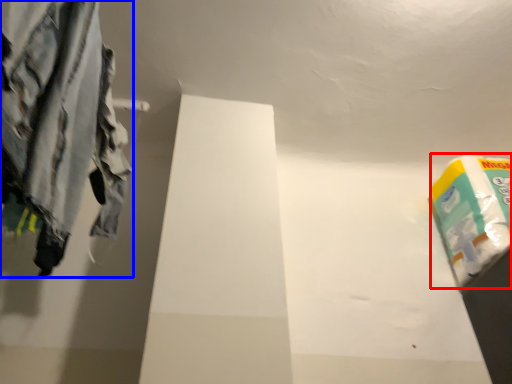
Question: Which object is closer to the camera taking this photo, toilet paper (highlighted by a red box) or trousers (highlighted by a blue box)?

Choices:
 (A) toilet paper
 (B) trousers

Answer: (B)